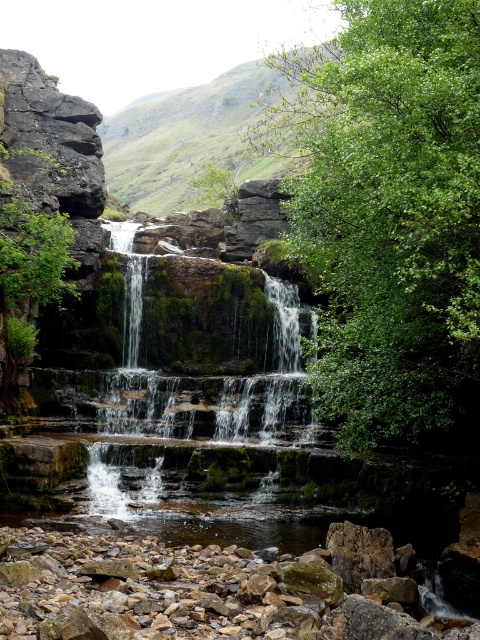
Does point (430, 288) lie in front of point (275, 166)?

Yes, point (430, 288) is in front of point (275, 166).

Is point (362, 422) farther from viewer compared to point (273, 74)?

No, it is not.

The width and height of the screenshot is (480, 640). Describe the element at coordinates (389, 214) in the screenshot. I see `green leafy tree at center` at that location.

What are the coordinates of `green leafy tree at center` in the screenshot? It's located at (389, 214).